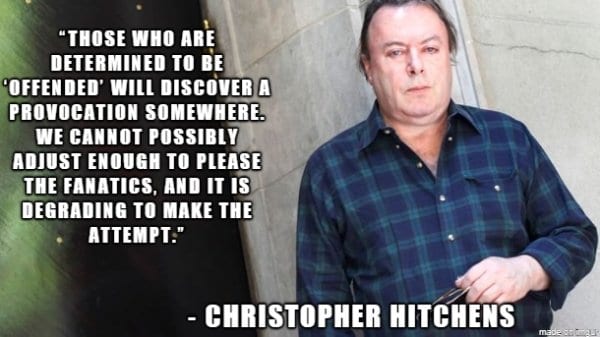
Image resolution: width=600 pixels, height=337 pixels. In order to click on light gray walls in this screenshot , I will do `click(307, 56)`, `click(532, 66)`.